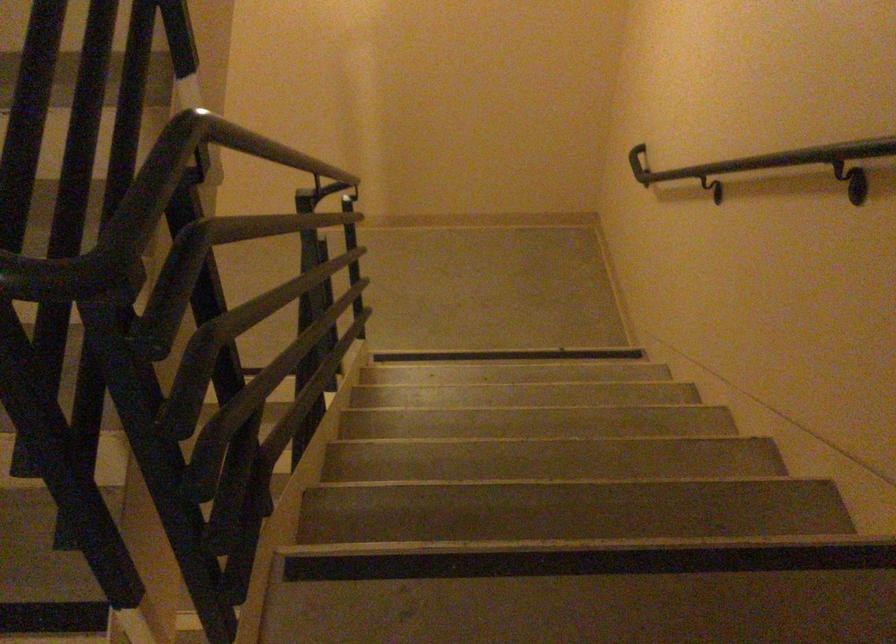
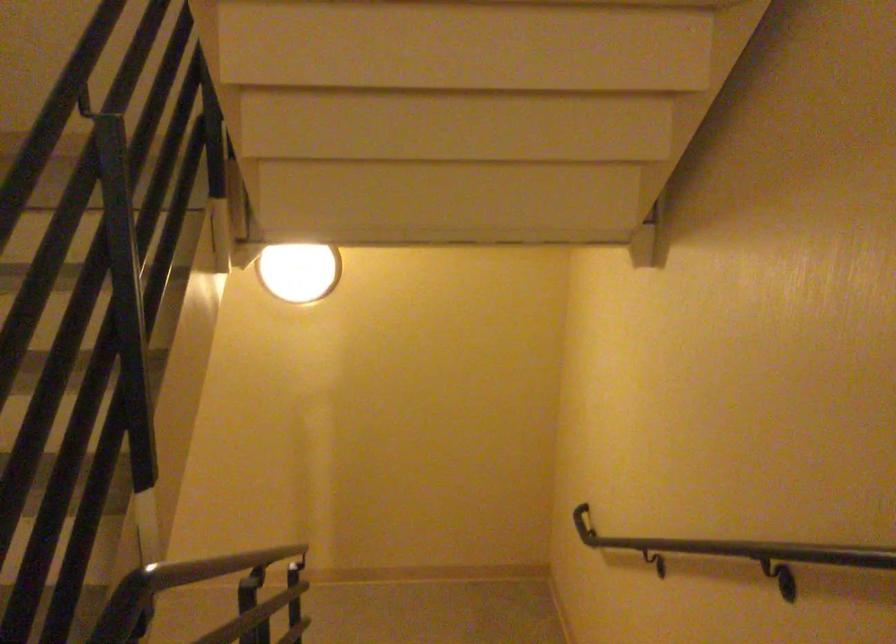
Question: Which direction would the cameraman need to move to produce the second image? Reply with the corresponding letter.

Choices:
 (A) Left
 (B) Right
 (C) Forward
 (D) Backward

Answer: (D)